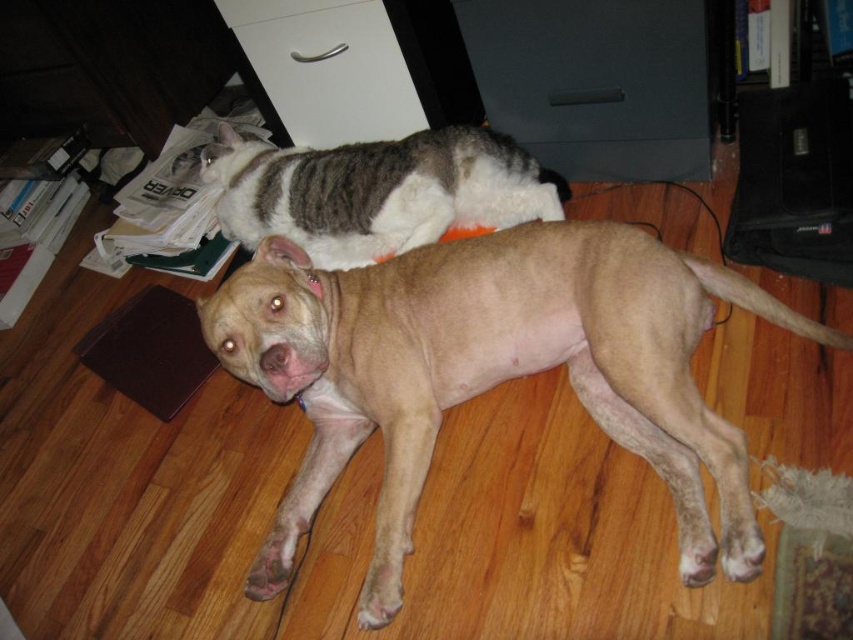
Question: Which point is closer to the camera?

Choices:
 (A) (323, 1)
 (B) (602, 262)
 (C) (334, 214)

Answer: (B)

Question: Is light brown smooth dog at center to the right of striped fur cat at upper center from the viewer's perspective?

Choices:
 (A) yes
 (B) no

Answer: (A)

Question: Which object is farther from the camera taking this photo?

Choices:
 (A) striped fur cat at upper center
 (B) white matte drawer at upper center

Answer: (B)

Question: Can you confirm if light brown smooth dog at center is positioned to the left of striped fur cat at upper center?

Choices:
 (A) yes
 (B) no

Answer: (B)

Question: Which is nearer to the white matte drawer at upper center?

Choices:
 (A) light brown smooth dog at center
 (B) striped fur cat at upper center

Answer: (B)

Question: Is light brown smooth dog at center closer to camera compared to striped fur cat at upper center?

Choices:
 (A) no
 (B) yes

Answer: (B)